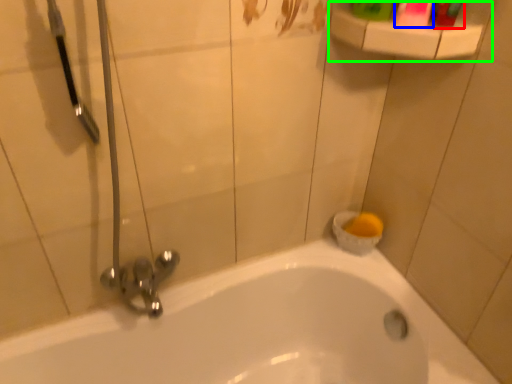
Question: Which is farther away from toiletry (highlighted by a red box)? mouthwash (highlighted by a blue box) or balustrade (highlighted by a green box)?

Choices:
 (A) mouthwash
 (B) balustrade

Answer: (B)